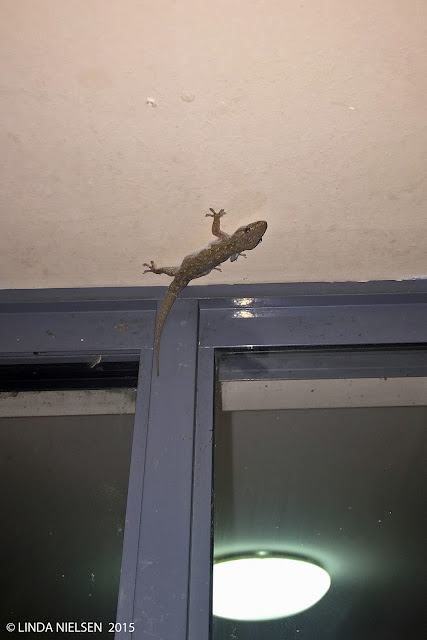
Identify the location of sliding glass door. This screenshot has height=640, width=427. (247, 368), (124, 381).